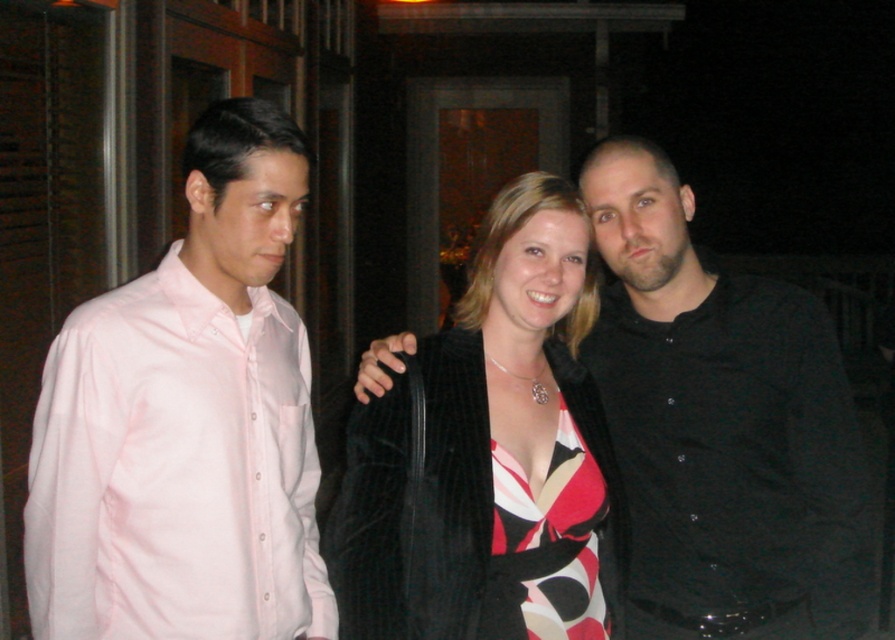
Question: Which object is farther from the camera taking this photo?

Choices:
 (A) velvet black coat at center
 (B) pink satin shirt at left
 (C) printed silk dress at center

Answer: (C)

Question: Which point is closer to the camera?

Choices:
 (A) (527, 211)
 (B) (581, 588)

Answer: (B)

Question: Estimate the real-world distances between objects in this image. Which object is closer to the printed silk dress at center?

Choices:
 (A) pink satin shirt at left
 (B) velvet black coat at center

Answer: (B)

Question: Can you confirm if velvet black coat at center is positioned to the left of printed silk dress at center?

Choices:
 (A) no
 (B) yes

Answer: (B)

Question: Is pink satin shirt at left wider than velvet black coat at center?

Choices:
 (A) no
 (B) yes

Answer: (A)

Question: Does pink satin shirt at left appear on the left side of velvet black coat at center?

Choices:
 (A) yes
 (B) no

Answer: (A)